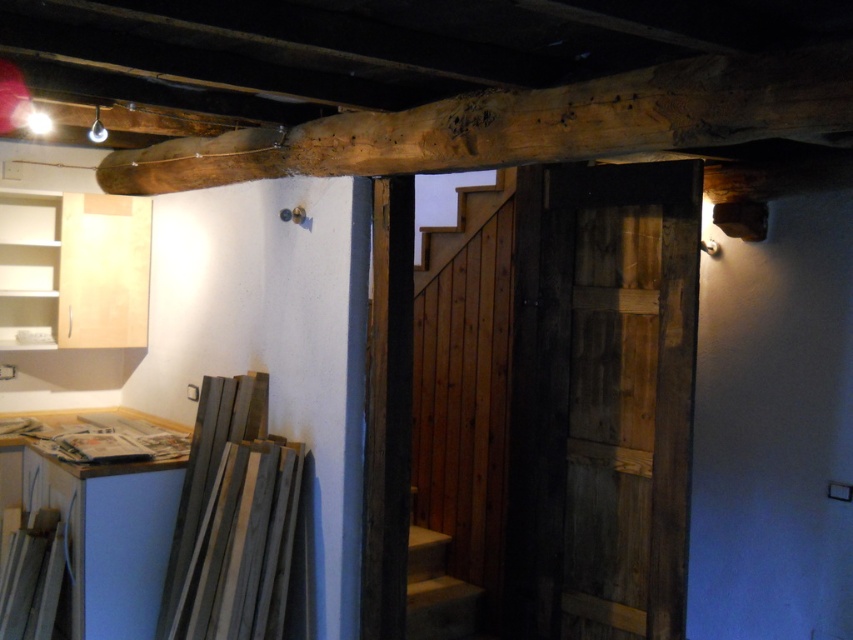
Is natural wood beam at upper center to the left of smooth concrete stairs at center from the viewer's perspective?

Correct, you'll find natural wood beam at upper center to the left of smooth concrete stairs at center.

Consider the image. Can you confirm if natural wood beam at upper center is positioned above smooth concrete stairs at center?

Correct, natural wood beam at upper center is located above smooth concrete stairs at center.

Measure the distance between natural wood beam at upper center and camera.

They are 5.99 feet apart.

The image size is (853, 640). Find the location of `natural wood beam at upper center`. natural wood beam at upper center is located at coordinates (521, 125).

Image resolution: width=853 pixels, height=640 pixels. I want to click on natural wood beam at upper center, so click(x=521, y=125).

Is natural wood beam at upper center shorter than gray matte wood at lower left?

Correct, natural wood beam at upper center is not as tall as gray matte wood at lower left.

Who is more forward, (570, 86) or (265, 456)?

Positioned in front is point (570, 86).

Where is `natural wood beam at upper center`? This screenshot has height=640, width=853. natural wood beam at upper center is located at coordinates (521, 125).

Is point (274, 502) positioned behind point (462, 609)?

No.

Who is lower down, gray matte wood at lower left or smooth concrete stairs at center?

smooth concrete stairs at center

Which is in front, point (209, 602) or point (412, 570)?

Positioned in front is point (209, 602).

Where is `gray matte wood at lower left`? gray matte wood at lower left is located at coordinates (233, 520).